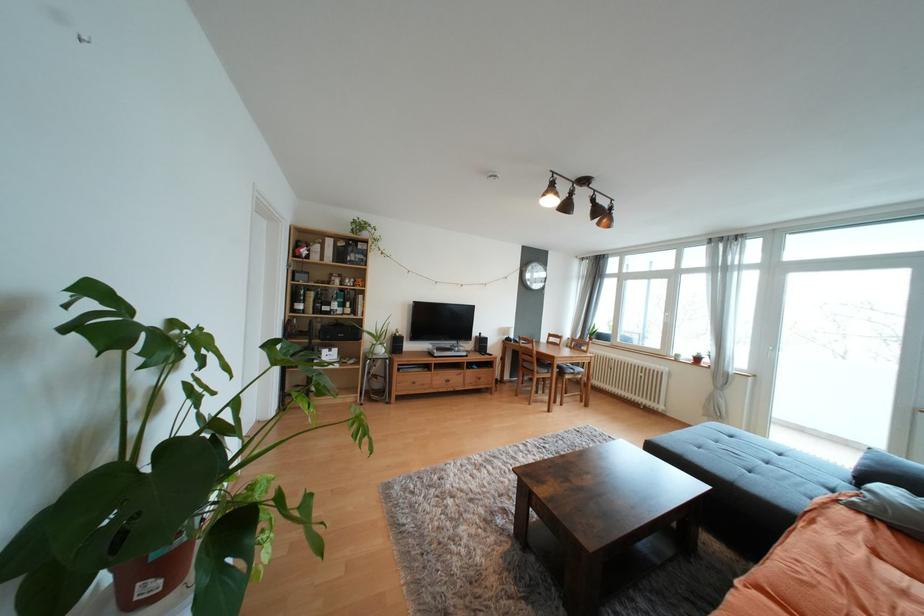
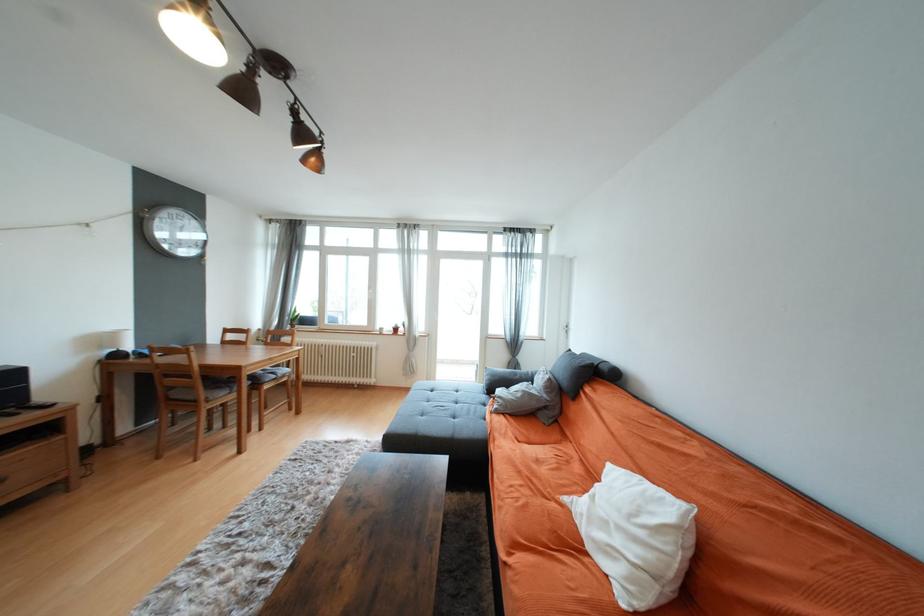
Locate, in the second image, the point that corresponds to (531,366) in the first image.

(181, 395)